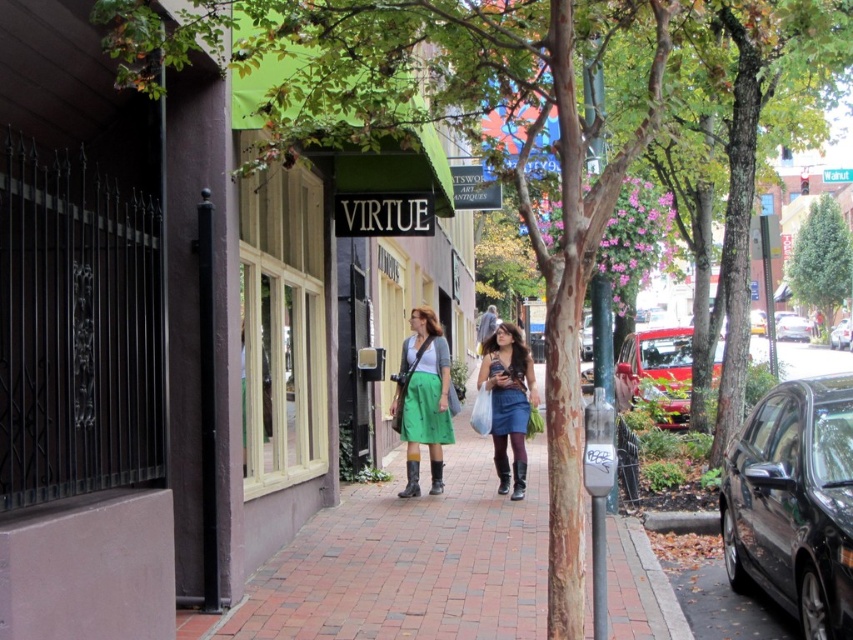
You are a delivery person who needs to park your bike between the brick pavement at center and the black glossy sedan at right. Is there enough space between them for your bike?

The brick pavement at center is to the left of the black glossy sedan at right, so there is space between them for the bike.

You are a delivery person who needs to park your 5 meter long truck between the green fabric awning at center and the shiny red car at right. Can you fit your truck there?

The distance between the green fabric awning at center and the shiny red car at right is 12.01 meters. Since your truck is 5 meters long, there is enough space to park it between them.

What are the coordinates of the green leafy tree at upper right in the image?

The coordinates of the green leafy tree at upper right are at point (821, 259).